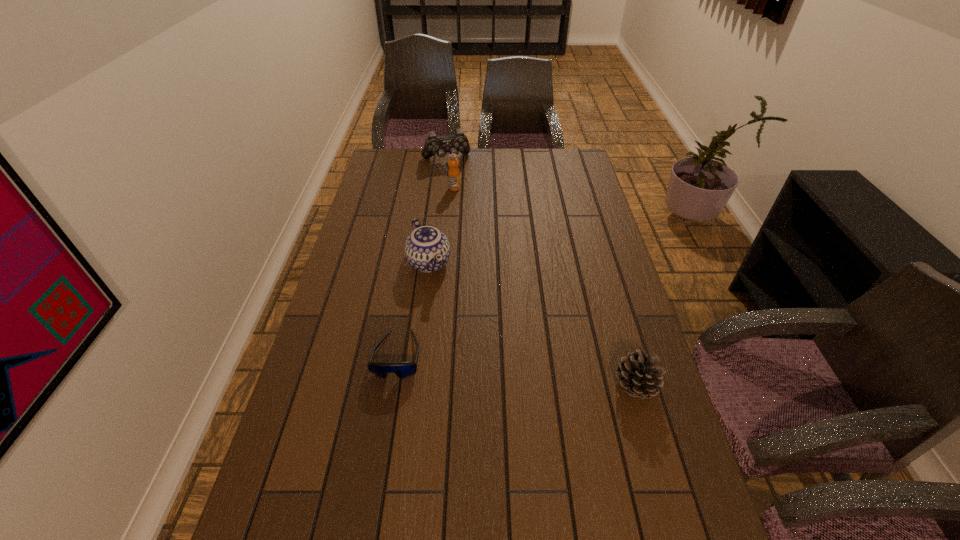
In order to click on free space on the desktop that is between the sunglasses and the pinecone and is positioned at the spout of the chinaware in this screenshot , I will do `click(492, 368)`.

This screenshot has width=960, height=540. Identify the location of free spot on the desktop that is between the sunglasses and the pinecone and is positioned on the surface of the farthest object with buttons. (516, 371).

The image size is (960, 540). What are the coordinates of `vacant space on the desktop that is between the shortest object and the pinecone and is positioned on the front label of the orange juice` in the screenshot? It's located at (535, 373).